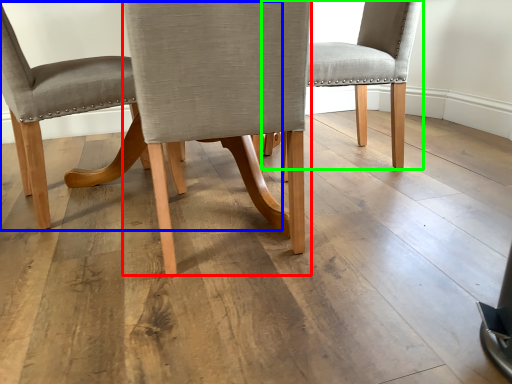
Question: Estimate the real-world distances between objects in this image. Which object is farther from chair (highlighted by a red box), chair (highlighted by a blue box) or chair (highlighted by a green box)?

Choices:
 (A) chair
 (B) chair

Answer: (B)